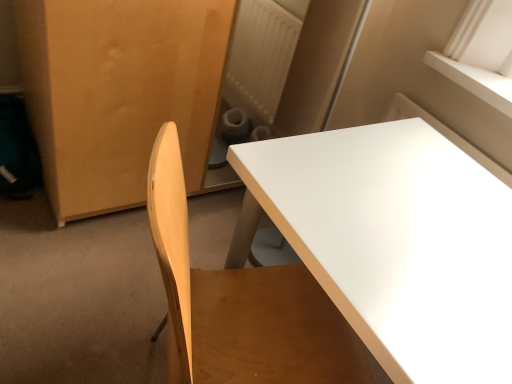
Find the location of a particular element. The height and width of the screenshot is (384, 512). empty space that is ontop of white glossy table at center (from a real-world perspective) is located at coordinates (408, 216).